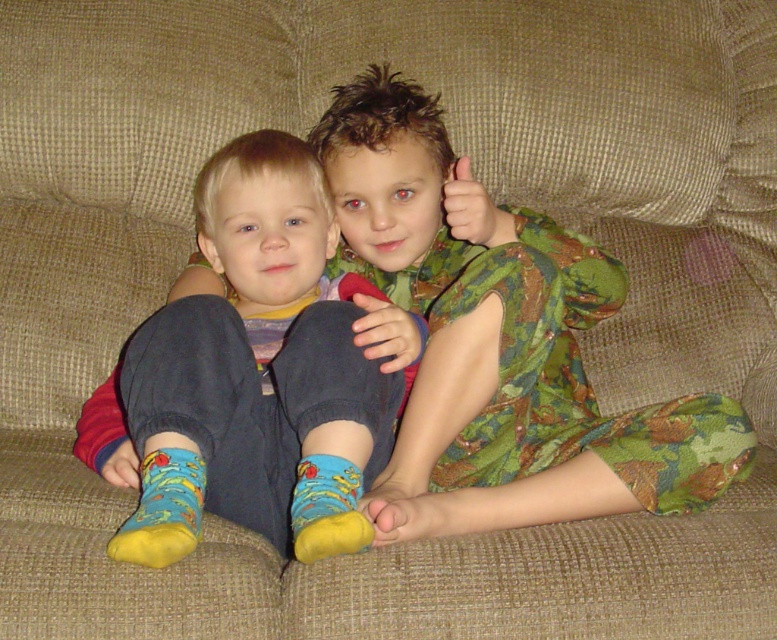
What is the exact coordinate position of the blue cotton socks at center?

The blue cotton socks at center are located at point (x=255, y=372).

You are trying to locate two specific points in the image. The first point is at coordinates point [215,499] and the second is at point [161,500]. Based on their positions, which point is closer to the front of the image?

Point [161,500] is closer to the front of the image because it is in front of point [215,499].